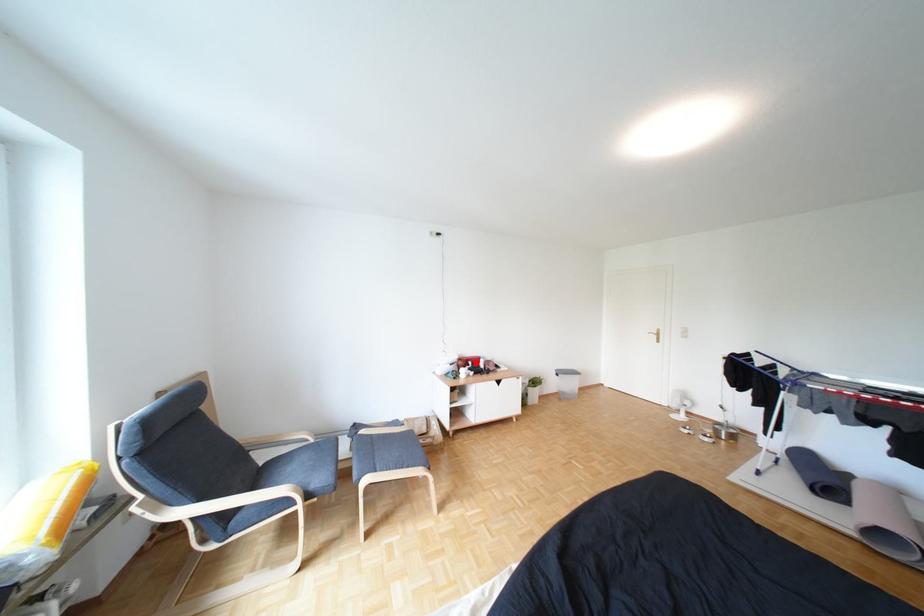
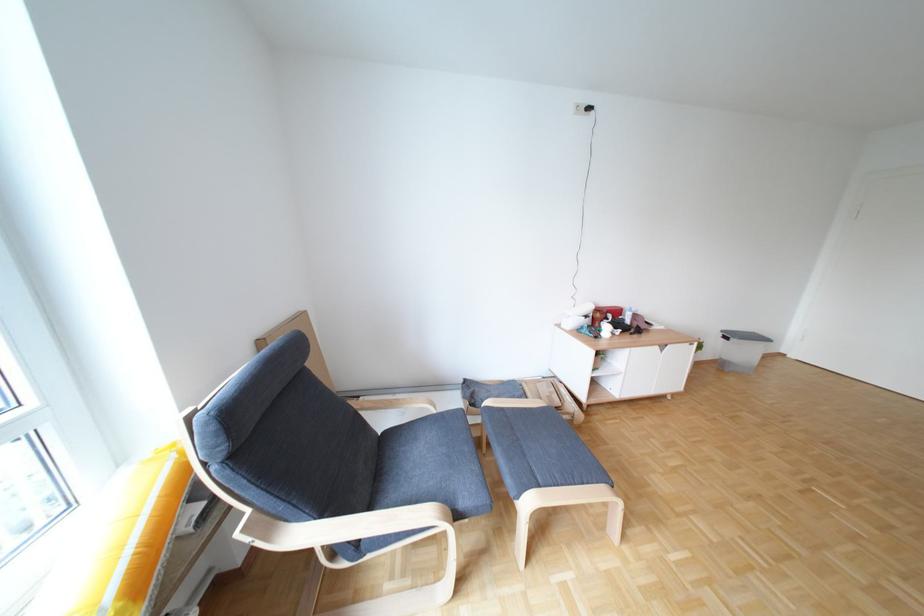
Locate, in the second image, the point that corresponds to the highlighted location in the first image.

(614, 315)